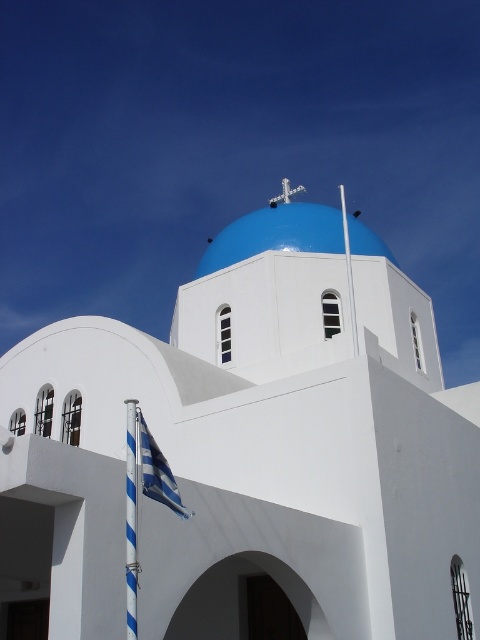
Question: Which object appears closest to the camera in this image?

Choices:
 (A) white smooth dome at center
 (B) blue glossy dome at center

Answer: (A)

Question: Does white smooth dome at center have a larger size compared to blue striped flag at lower left?

Choices:
 (A) no
 (B) yes

Answer: (B)

Question: Does white smooth dome at center come behind blue glossy dome at center?

Choices:
 (A) no
 (B) yes

Answer: (A)

Question: Which point is closer to the camera?

Choices:
 (A) white smooth dome at center
 (B) blue glossy dome at center

Answer: (A)

Question: Is white smooth dome at center positioned behind blue striped flag at lower left?

Choices:
 (A) yes
 (B) no

Answer: (B)

Question: Which point is farther from the camera taking this photo?

Choices:
 (A) (361, 548)
 (B) (128, 438)
 (C) (242, 243)

Answer: (C)